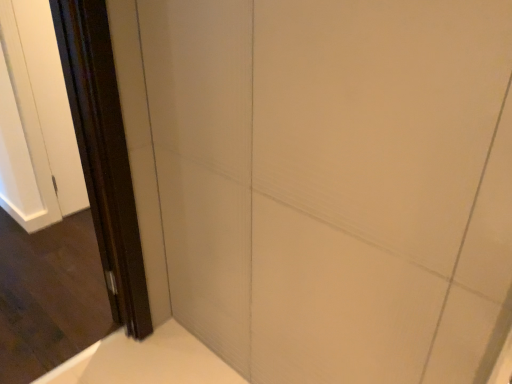
Question: Is dark brown wood screen door at left, which is the first screen door from front to back, taller or shorter than dark brown wood screen door at left, positioned as the first screen door in back-to-front order?

Choices:
 (A) tall
 (B) short

Answer: (A)

Question: From a real-world perspective, is dark brown wood screen door at left, the 2th screen door viewed from the back, positioned above or below dark brown wood screen door at left, which is the 2th screen door in front-to-back order?

Choices:
 (A) below
 (B) above

Answer: (B)

Question: Looking at their shapes, would you say dark brown wood screen door at left, the 2th screen door viewed from the back, is wider or thinner than dark brown wood screen door at left, which is the 2th screen door in front-to-back order?

Choices:
 (A) thin
 (B) wide

Answer: (B)

Question: From the image's perspective, is dark brown wood screen door at left, positioned as the first screen door in back-to-front order, positioned above or below dark brown wood screen door at left, which is the first screen door from front to back?

Choices:
 (A) above
 (B) below

Answer: (A)

Question: Is dark brown wood screen door at left, which is the 2th screen door in front-to-back order, bigger or smaller than dark brown wood screen door at left, which is the first screen door from front to back?

Choices:
 (A) big
 (B) small

Answer: (B)

Question: Do you think dark brown wood screen door at left, positioned as the first screen door in back-to-front order, is within dark brown wood screen door at left, the 2th screen door viewed from the back, or outside of it?

Choices:
 (A) inside
 (B) outside

Answer: (B)

Question: Considering their positions, is dark brown wood screen door at left, positioned as the first screen door in back-to-front order, located in front of or behind dark brown wood screen door at left, the 2th screen door viewed from the back?

Choices:
 (A) front
 (B) behind

Answer: (B)